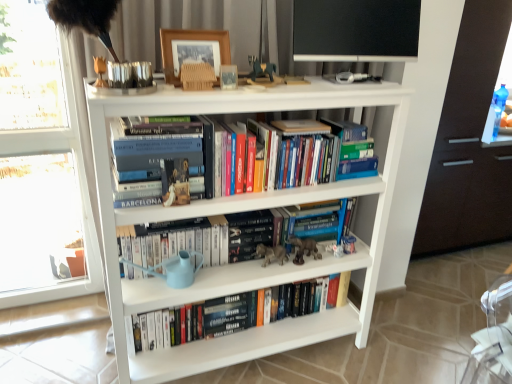
Where is `blank space situated above black matte paperback book at center (from a real-world perspective)`? blank space situated above black matte paperback book at center (from a real-world perspective) is located at coordinates (244, 214).